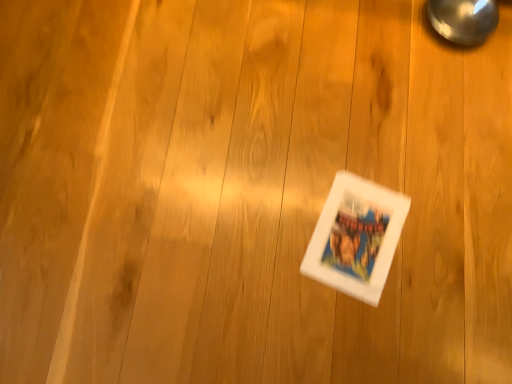
Where is `free point above white matte comic book at center (from a real-world perspective)`? free point above white matte comic book at center (from a real-world perspective) is located at coordinates (353, 229).